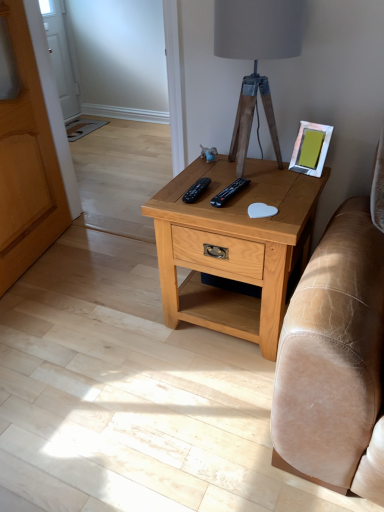
Image resolution: width=384 pixels, height=512 pixels. I want to click on free space in front of metallic silver picture frame at upper right, so [x=304, y=188].